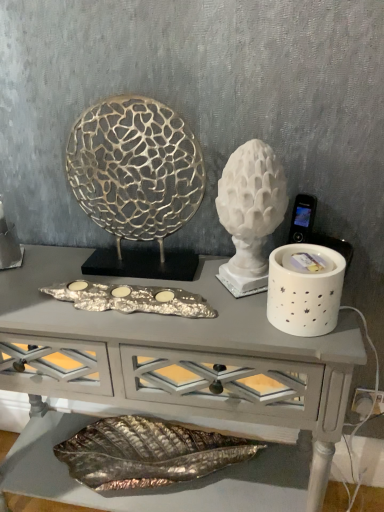
Locate an element on the screen. Image resolution: width=384 pixels, height=512 pixels. spots to the right of silver metallic tray at center is located at coordinates (220, 307).